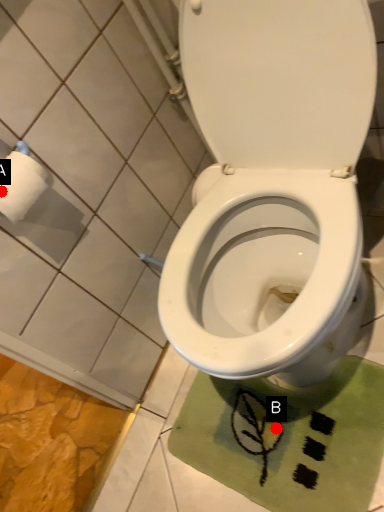
Question: Two points are circled on the image, labeled by A and B beside each circle. Among these points, which one is nearest to the camera?

Choices:
 (A) A is closer
 (B) B is closer

Answer: (A)